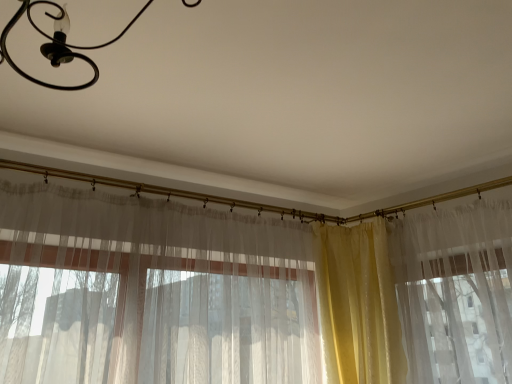
Question: Would you consider yellow satin curtain at right, which is the second curtain from left to right, to be distant from translucent fabric curtain at center, which is the 2th curtain in right-to-left order?

Choices:
 (A) no
 (B) yes

Answer: (A)

Question: Is yellow satin curtain at right, which is the 1th curtain from right to left, positioned beyond the bounds of translucent fabric curtain at center, which is the first curtain in left-to-right order?

Choices:
 (A) yes
 (B) no

Answer: (B)

Question: Is yellow satin curtain at right, which is the 1th curtain from right to left, touching translucent fabric curtain at center, which is the first curtain in left-to-right order?

Choices:
 (A) yes
 (B) no

Answer: (B)

Question: Is translucent fabric curtain at center, which is the first curtain in left-to-right order, a part of yellow satin curtain at right, which is the 1th curtain from right to left?

Choices:
 (A) no
 (B) yes

Answer: (A)

Question: From the image's perspective, is yellow satin curtain at right, which is the 1th curtain from right to left, located above translucent fabric curtain at center, which is the first curtain in left-to-right order?

Choices:
 (A) yes
 (B) no

Answer: (B)

Question: Considering the positions of translucent fabric curtain at center, which is the 2th curtain in right-to-left order, and yellow satin curtain at right, which is the 1th curtain from right to left, in the image, is translucent fabric curtain at center, which is the 2th curtain in right-to-left order, bigger or smaller than yellow satin curtain at right, which is the 1th curtain from right to left,?

Choices:
 (A) big
 (B) small

Answer: (A)

Question: In terms of width, does translucent fabric curtain at center, which is the first curtain in left-to-right order, look wider or thinner when compared to yellow satin curtain at right, which is the 1th curtain from right to left?

Choices:
 (A) thin
 (B) wide

Answer: (A)

Question: From a real-world perspective, is translucent fabric curtain at center, which is the first curtain in left-to-right order, above or below yellow satin curtain at right, which is the 1th curtain from right to left?

Choices:
 (A) below
 (B) above

Answer: (B)

Question: In the image, is translucent fabric curtain at center, which is the 2th curtain in right-to-left order, positioned in front of or behind yellow satin curtain at right, which is the second curtain from left to right?

Choices:
 (A) front
 (B) behind

Answer: (A)

Question: From a real-world perspective, is yellow satin curtain at right, which is the second curtain from left to right, physically located above or below black matte chandelier at upper left?

Choices:
 (A) below
 (B) above

Answer: (A)

Question: In the image, is yellow satin curtain at right, which is the 1th curtain from right to left, on the left side or the right side of black matte chandelier at upper left?

Choices:
 (A) right
 (B) left

Answer: (A)

Question: In terms of height, does yellow satin curtain at right, which is the 1th curtain from right to left, look taller or shorter compared to black matte chandelier at upper left?

Choices:
 (A) short
 (B) tall

Answer: (B)

Question: Considering their positions, is yellow satin curtain at right, which is the 1th curtain from right to left, located in front of or behind black matte chandelier at upper left?

Choices:
 (A) front
 (B) behind

Answer: (B)

Question: Considering the positions of black matte chandelier at upper left and yellow satin curtain at right, which is the second curtain from left to right, in the image, is black matte chandelier at upper left taller or shorter than yellow satin curtain at right, which is the second curtain from left to right,?

Choices:
 (A) tall
 (B) short

Answer: (B)

Question: In terms of width, does black matte chandelier at upper left look wider or thinner when compared to yellow satin curtain at right, which is the 1th curtain from right to left?

Choices:
 (A) thin
 (B) wide

Answer: (B)